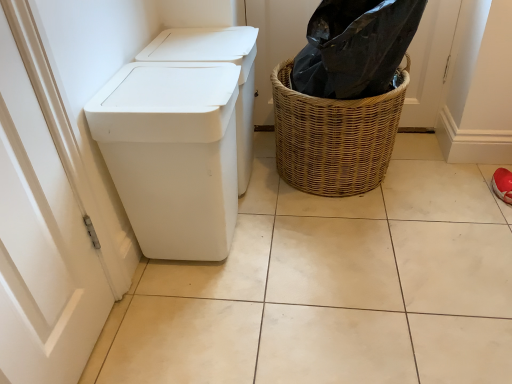
Locate an element on the screen. This screenshot has width=512, height=384. free space in front of woven brown basket at right is located at coordinates (359, 250).